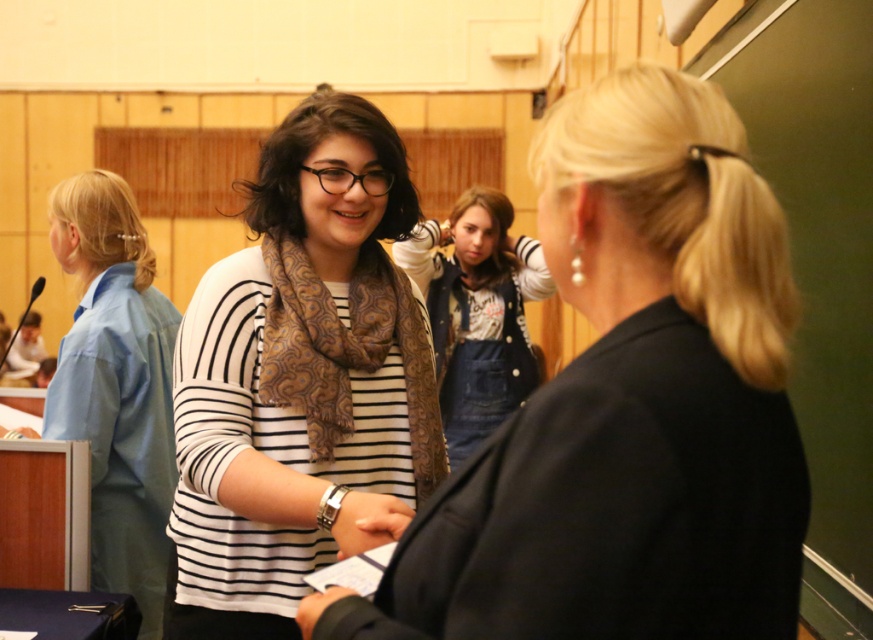
Which is in front, point (94, 486) or point (416, 264)?

Point (94, 486)

Does blue fabric shirt at left have a lesser height compared to denim overalls at center?

In fact, blue fabric shirt at left may be taller than denim overalls at center.

Who is more forward, (160, 406) or (485, 401)?

Point (160, 406) is in front.

At what (x,y) coordinates should I click in order to perform the action: click on blue fabric shirt at left. Please return your answer as a coordinate pair (x, y). The image size is (873, 640). Looking at the image, I should click on (115, 385).

Does point (287, 632) lie behind point (475, 433)?

No, it is not.

The height and width of the screenshot is (640, 873). I want to click on striped cotton shirt at center, so click(x=299, y=380).

Does point (383, 266) lie behind point (475, 323)?

No.

I want to click on striped cotton shirt at center, so click(x=299, y=380).

Is brown paisley scarf at center above denim overalls at center?

Incorrect, brown paisley scarf at center is not positioned above denim overalls at center.

Is brown paisley scarf at center closer to the viewer compared to denim overalls at center?

Yes, it is in front of denim overalls at center.

What do you see at coordinates (346, 349) in the screenshot? I see `brown paisley scarf at center` at bounding box center [346, 349].

Image resolution: width=873 pixels, height=640 pixels. Identify the location of brown paisley scarf at center. (346, 349).